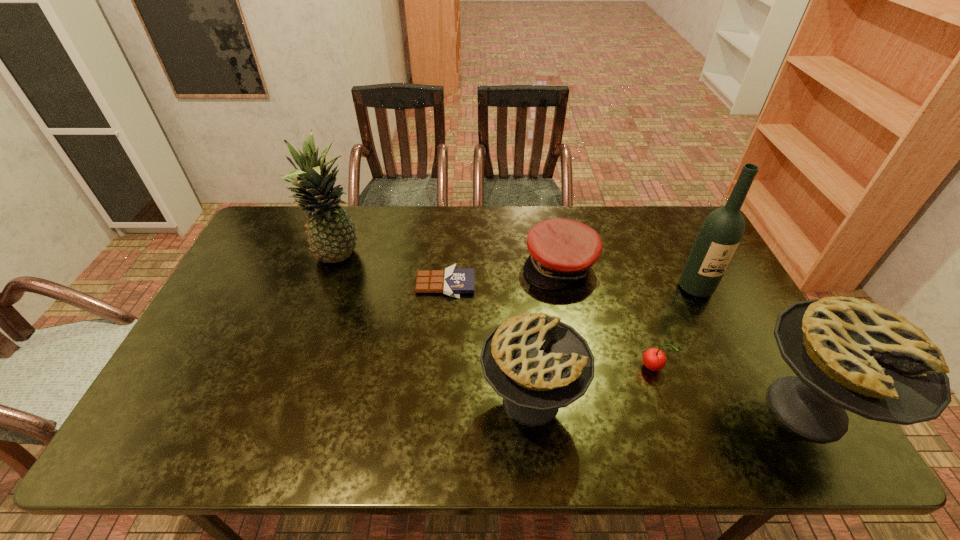
Locate an element on the screen. the fourth tallest object is located at coordinates (536, 363).

Identify the location of the shorter pie. (536, 363).

Locate an element on the screen. This screenshot has height=540, width=960. the right pie is located at coordinates (848, 353).

Locate an element on the screen. The height and width of the screenshot is (540, 960). the fifth shortest object is located at coordinates (848, 353).

Identify the location of cap. This screenshot has width=960, height=540. (562, 251).

Find the location of `the leftmost object`. the leftmost object is located at coordinates (331, 234).

Where is `the sixth object from right to left`? The height and width of the screenshot is (540, 960). the sixth object from right to left is located at coordinates (453, 281).

Image resolution: width=960 pixels, height=540 pixels. In order to click on the shortest object in this screenshot , I will do `click(453, 281)`.

This screenshot has height=540, width=960. I want to click on the fifth object from left to right, so click(x=654, y=359).

Where is `wine bottle`? This screenshot has height=540, width=960. wine bottle is located at coordinates (721, 232).